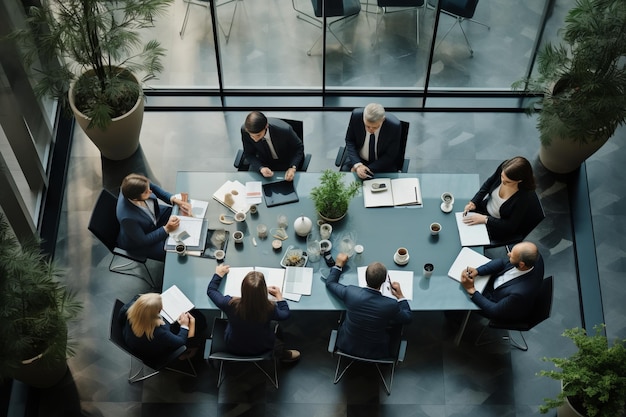
This screenshot has height=417, width=626. I want to click on windows, so click(x=172, y=28), click(x=72, y=69), click(x=258, y=65), click(x=386, y=59), click(x=489, y=66), click(x=558, y=20), click(x=48, y=102), click(x=36, y=141), click(x=21, y=187).